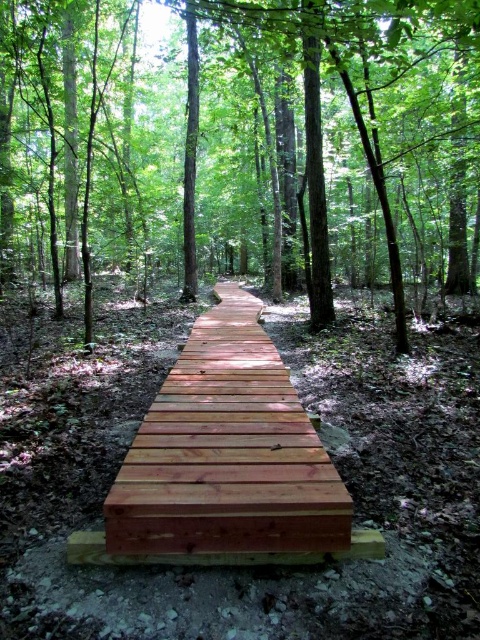
Is brown wooden bridge at center above light brown wooden walkway at center?

Yes.

Does point (439, 260) come in front of point (156, 476)?

No, it is behind (156, 476).

The height and width of the screenshot is (640, 480). Find the location of `brown wooden bridge at center`. brown wooden bridge at center is located at coordinates (240, 145).